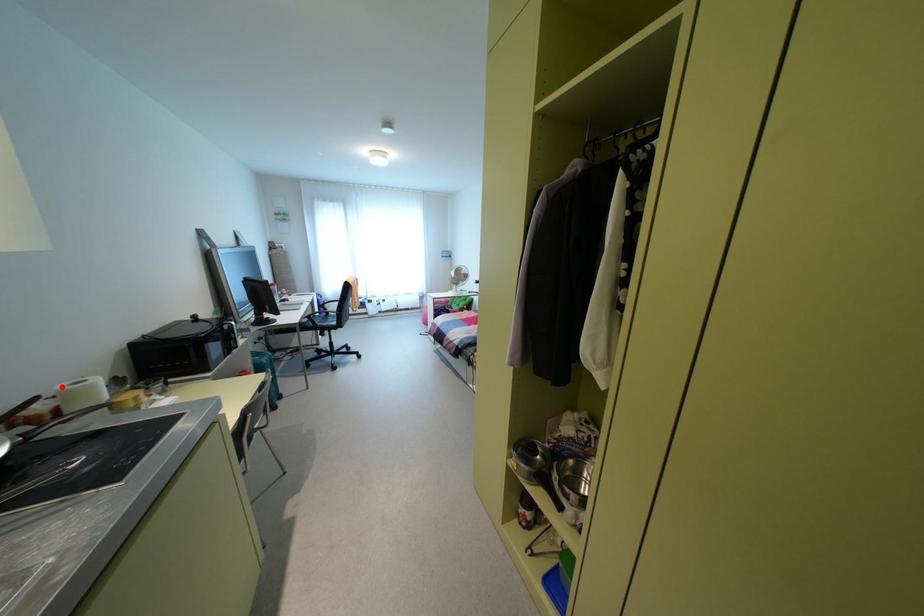
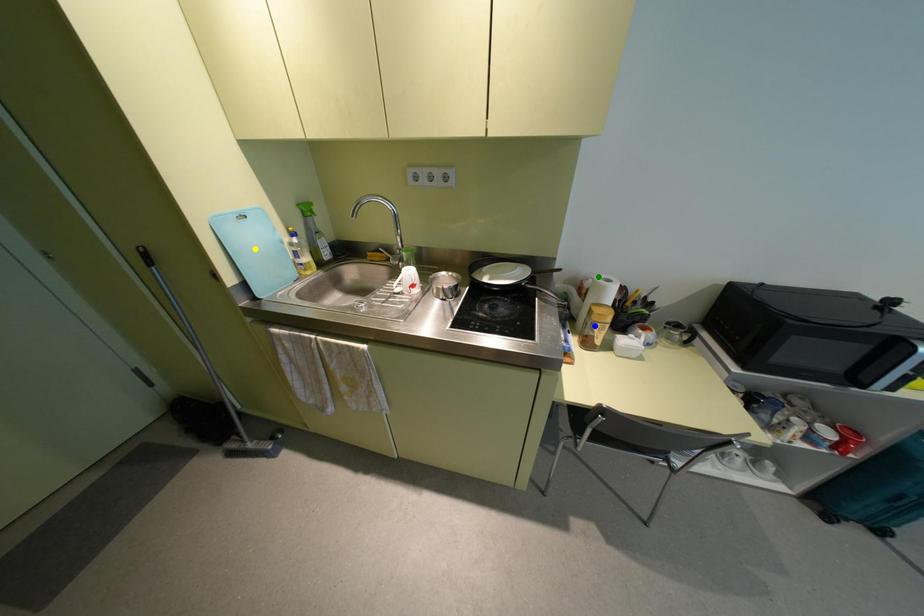
Question: I am providing you with two images of the same scene from different viewpoints. A red point is marked on the first image. You are given multiple points on the second image. Which point in image 2 represents the same 3d spot as the red point in image 1?

Choices:
 (A) yellow point
 (B) green point
 (C) blue point

Answer: (B)